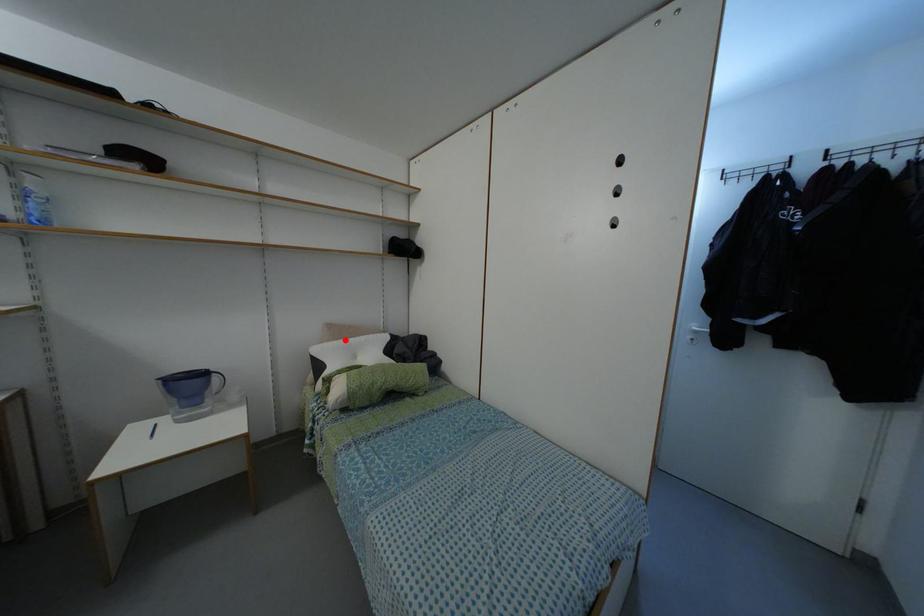
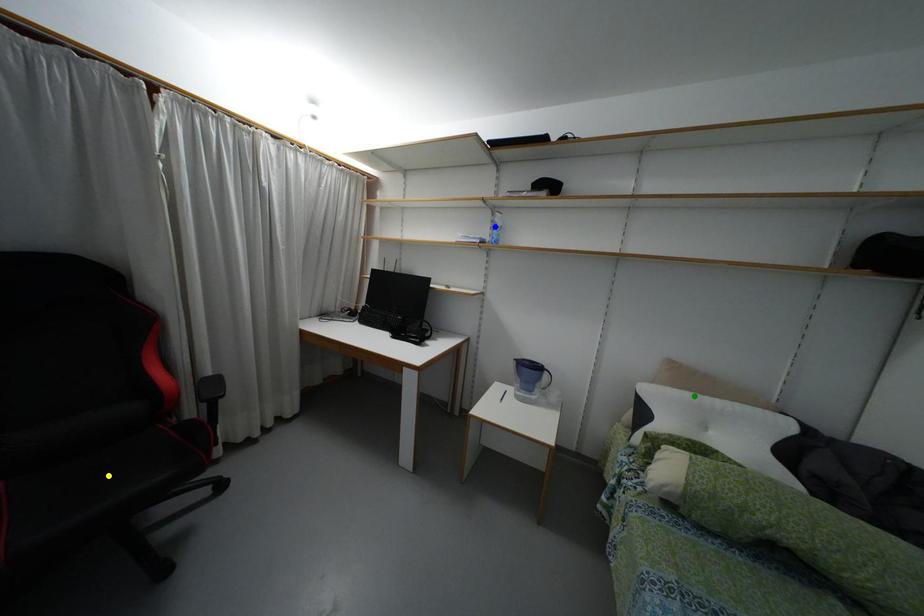
Question: I am providing you with two images of the same scene from different viewpoints. A red point is marked on the first image. You are given multiple points on the second image. Which point in image 2 represents the same 3d spot as the red point in image 1?

Choices:
 (A) yellow point
 (B) green point
 (C) blue point

Answer: (B)